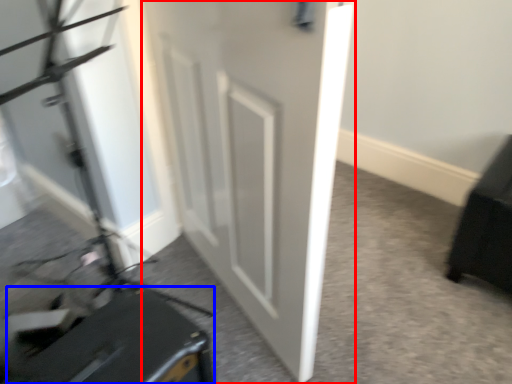
Question: Which of the following is the farthest to the observer, door (highlighted by a red box) or luggage (highlighted by a blue box)?

Choices:
 (A) door
 (B) luggage

Answer: (B)